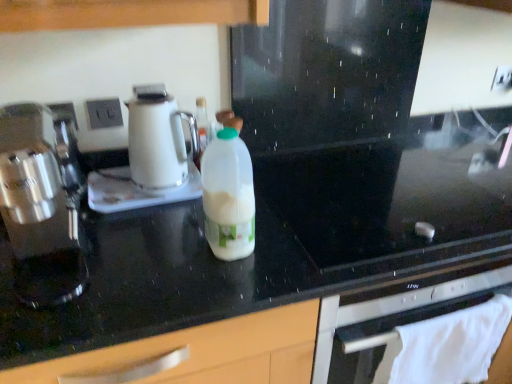
Question: Based on their sizes in the image, would you say white cloth towel at lower right is bigger or smaller than black glass gas stove at center?

Choices:
 (A) big
 (B) small

Answer: (B)

Question: In terms of width, does white cloth towel at lower right look wider or thinner when compared to black glass gas stove at center?

Choices:
 (A) thin
 (B) wide

Answer: (A)

Question: Which object is positioned farthest from the white glossy electric kettle at center, the second kitchen appliance from the front?

Choices:
 (A) white cloth towel at lower right
 (B) white glossy kettle at center
 (C) white plastic electric outlet at upper left, acting as the 1th electric outlet starting from the bottom
 (D) satin silver coffee maker at left, arranged as the 1th kitchen appliance when viewed from the front
 (E) white plastic electric outlet at upper center, positioned as the first electric outlet in right-to-left order

Answer: (E)

Question: Considering the real-world distances, which object is closest to the white cloth towel at lower right?

Choices:
 (A) satin silver coffee maker at left, arranged as the 1th kitchen appliance when viewed from the front
 (B) black glass gas stove at center
 (C) white plastic electric outlet at upper left, positioned as the 2th electric outlet in top-to-bottom order
 (D) white plastic electric outlet at upper center, the first electric outlet when ordered from top to bottom
 (E) white plastic bottle at center

Answer: (B)